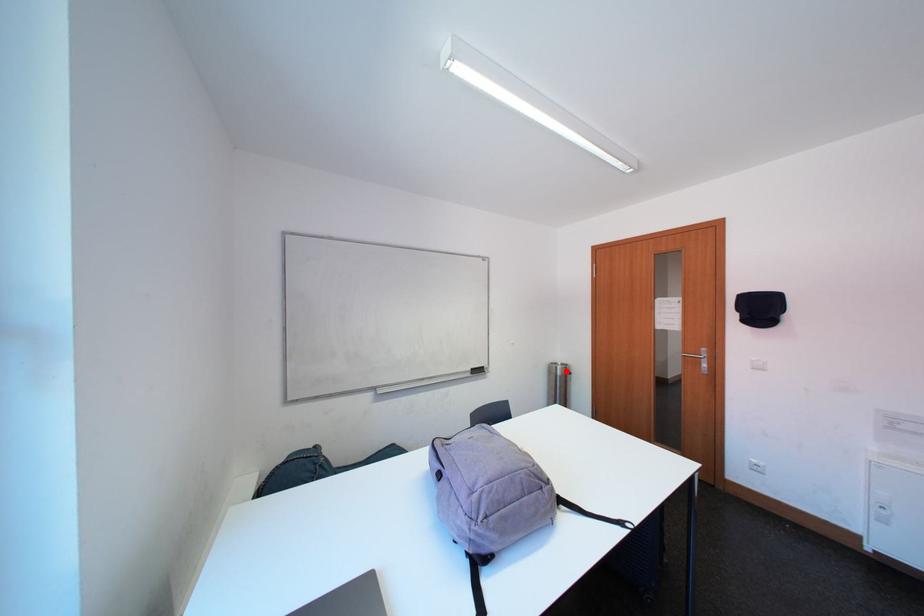
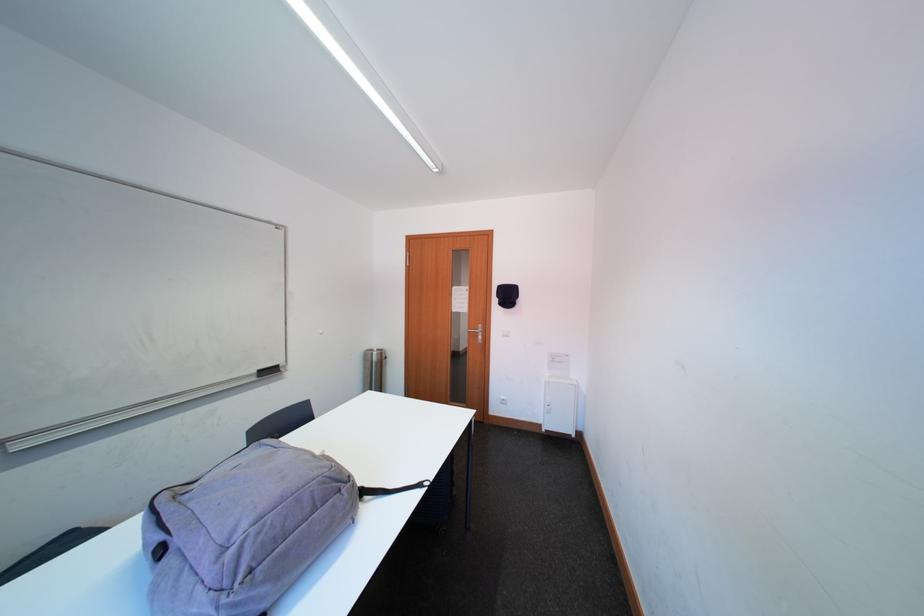
Locate, in the second image, the point that corresponds to the highlighted location in the first image.

(382, 358)